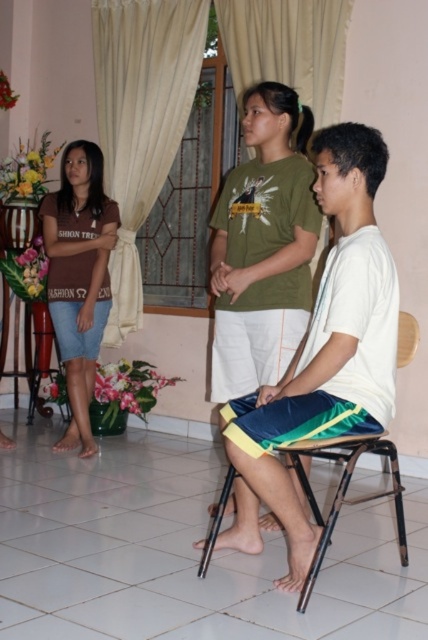
Who is positioned more to the right, white fabric shirt at center or matte brown shirt at left?

From the viewer's perspective, white fabric shirt at center appears more on the right side.

Can you confirm if white fabric shirt at center is positioned to the left of matte brown shirt at left?

No, white fabric shirt at center is not to the left of matte brown shirt at left.

You are a GUI agent. You are given a task and a screenshot of the screen. Output one action in this format:
    pyautogui.click(x=<x>, y=<y>)
    Task: Click on the white fabric shirt at center
    Image resolution: width=428 pixels, height=640 pixels.
    Given the screenshot: What is the action you would take?
    pyautogui.click(x=323, y=355)

Does white fabric shirt at center have a lesser height compared to green cotton t-shirt at center?

No, white fabric shirt at center is not shorter than green cotton t-shirt at center.

Is point (326, 259) more distant than point (308, 124)?

No, (326, 259) is in front of (308, 124).

At what (x,y) coordinates should I click in order to perform the action: click on white fabric shirt at center. Please return your answer as a coordinate pair (x, y). Looking at the image, I should click on (323, 355).

This screenshot has width=428, height=640. Describe the element at coordinates (79, 276) in the screenshot. I see `matte brown shirt at left` at that location.

Does point (71, 328) come behind point (234, 35)?

That is False.

Is point (88, 172) positioned after point (306, 100)?

Yes, it is.

Identify the location of matte brown shirt at left. (79, 276).